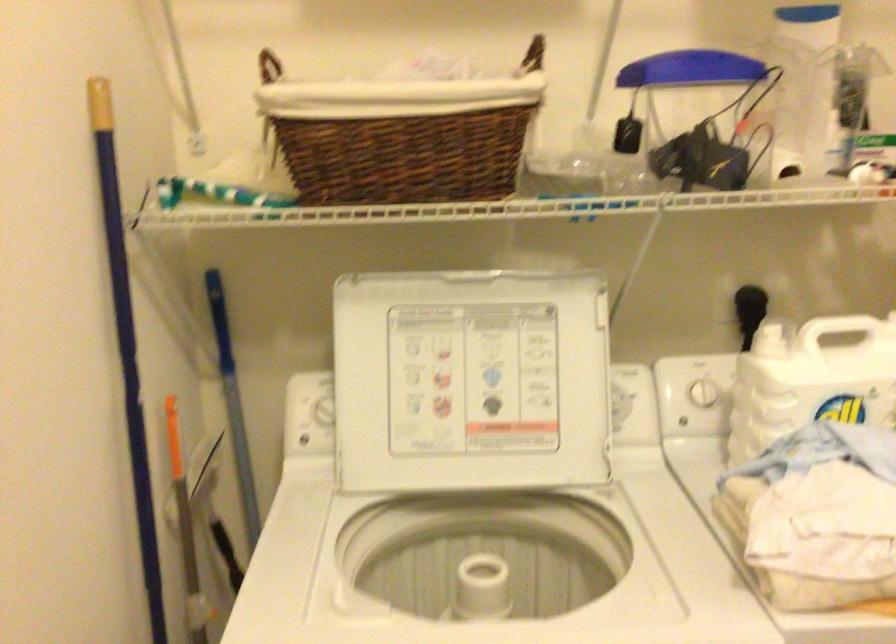
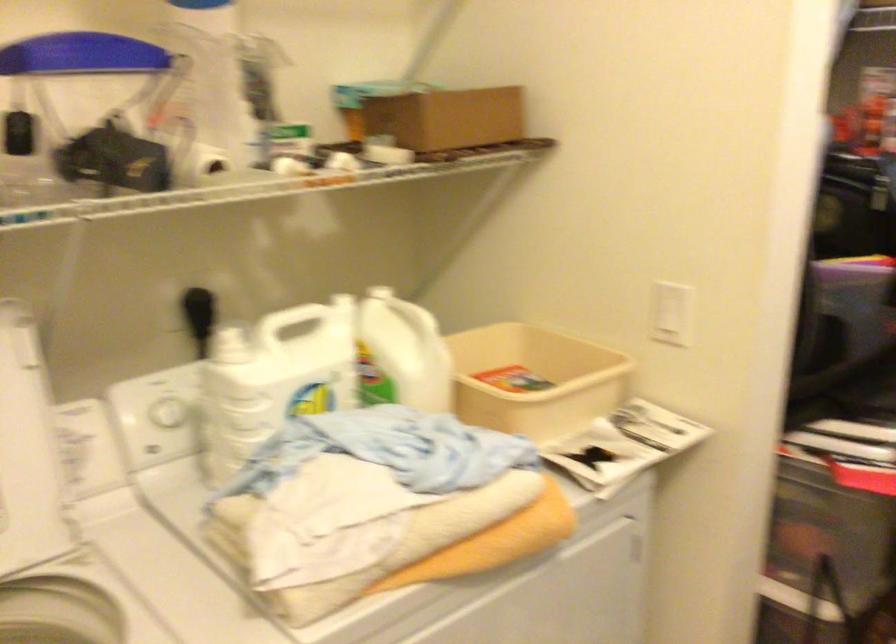
Question: The first image is from the beginning of the video and the second image is from the end. How did the camera likely rotate when shooting the video?

Choices:
 (A) Left
 (B) Right
 (C) Up
 (D) Down

Answer: (B)